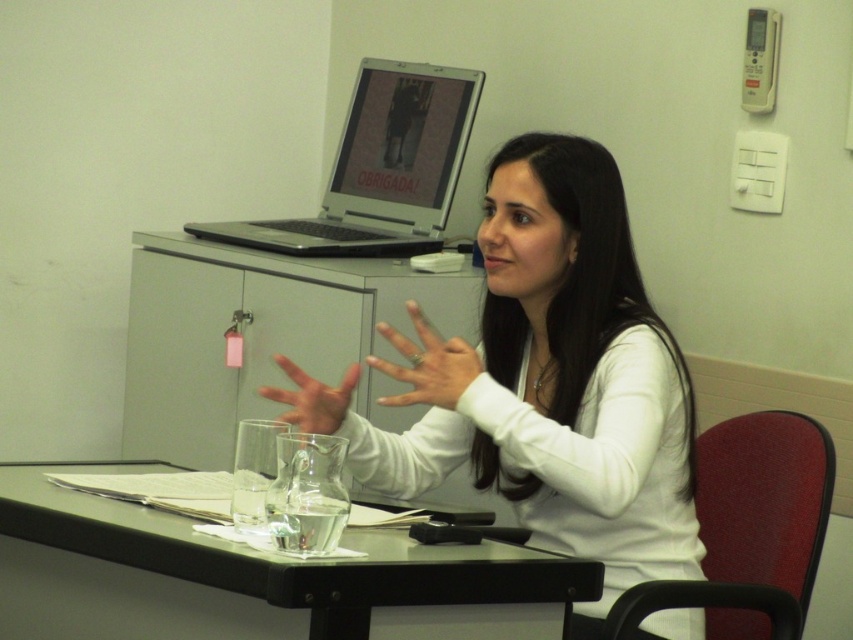
You are organizing a meeting in an office. You have a black plastic table at center and a silver metallic laptop at upper center. Which object has a greater width?

The black plastic table at center has a greater width than the silver metallic laptop at upper center.